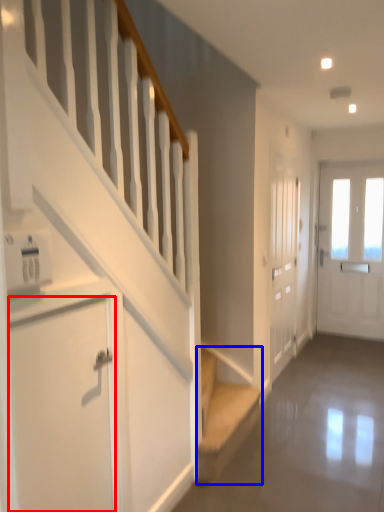
Question: Which object appears farthest to the camera in this image, door (highlighted by a red box) or stairs (highlighted by a blue box)?

Choices:
 (A) door
 (B) stairs

Answer: (B)